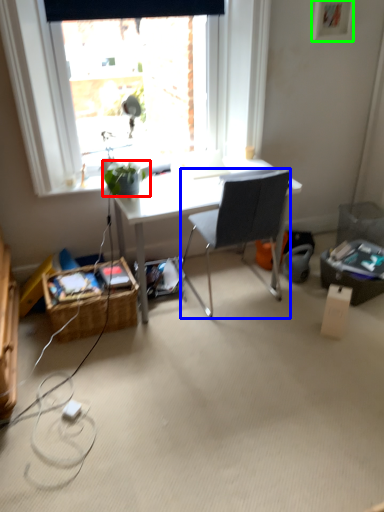
Question: Which object is positioned farthest from houseplant (highlighted by a red box)? Select from chair (highlighted by a blue box) and picture frame (highlighted by a green box).

Choices:
 (A) chair
 (B) picture frame

Answer: (B)